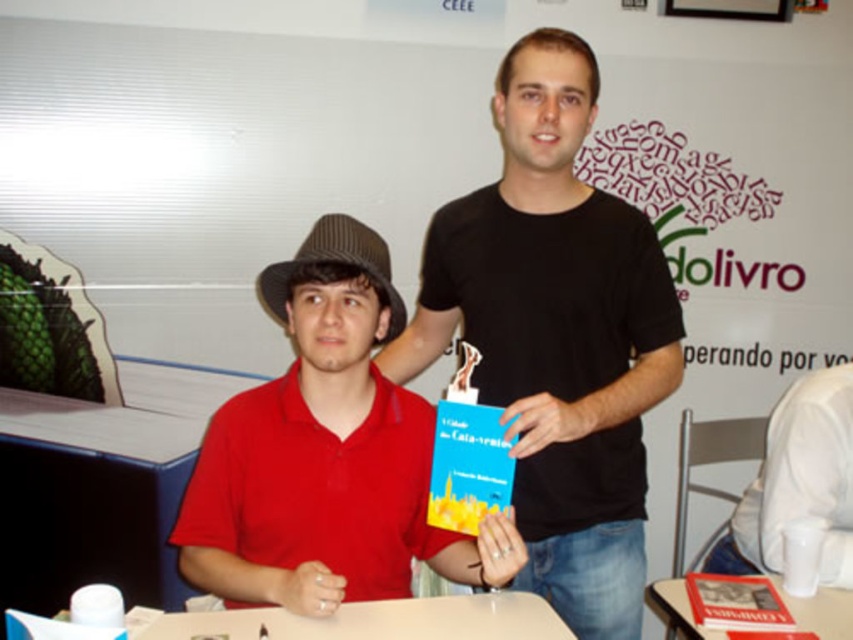
In the scene shown: What are the coordinates of the matte red shirt at center?

The coordinates of the matte red shirt at center are at point [326,454].

You are organizing a book signing event and need to place a 1.5 meter long banner between the matte red shirt at center and the white glossy table at lower right. Given their widths, will the banner fit between them without overlapping either object?

The matte red shirt at center is wider than the white glossy table at lower right. Since the banner is 1.5 meters long, it can fit between them as long as the combined width of both objects plus the banner length does not exceed the available space. However, without knowing the exact distance between them, it is impossible to confirm if the banner will fit without overlapping.

You are a photographer at a book signing event. You need to capture a photo that includes both the matte red shirt at center and the white glossy table at lower right. Based on their positions, which object should be placed on the left side of the frame to ensure both are visible?

The matte red shirt at center should be placed on the left side of the frame because it is already positioned on the left side of the white glossy table at lower right, ensuring both are visible in the photo.